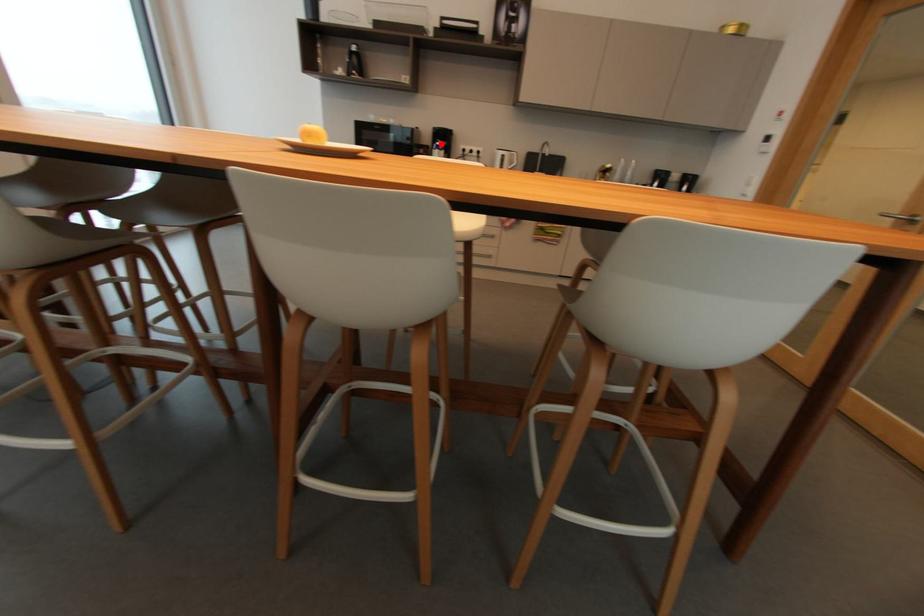
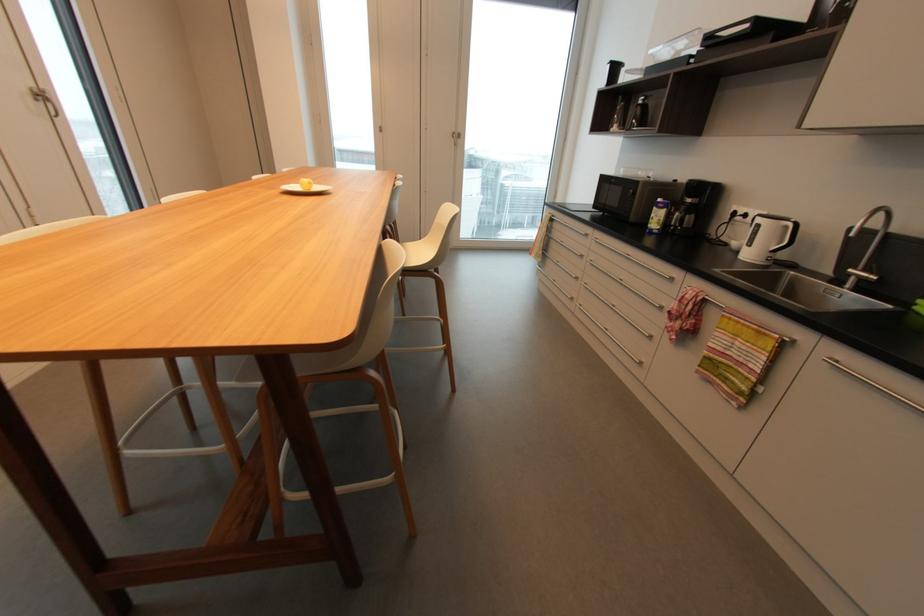
In the second image, find the point that corresponds to the highlighted location in the first image.

(663, 200)